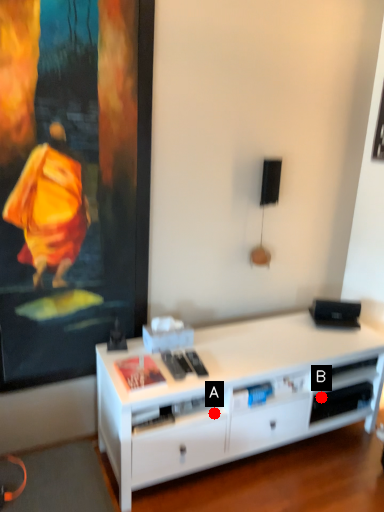
Question: Two points are circled on the image, labeled by A and B beside each circle. Which point is further to the camera?

Choices:
 (A) A is further
 (B) B is further

Answer: (B)